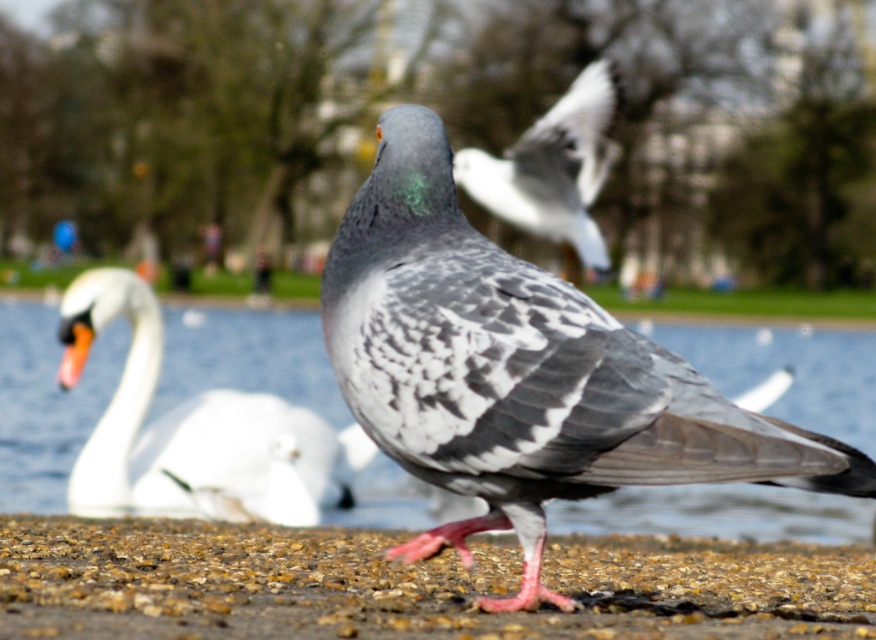
Does point (464, 408) lie behind point (146, 632)?

Yes, point (464, 408) is farther from viewer.

Which of these two, speckled feather pigeon at center or brown gravel at center, stands shorter?

brown gravel at center

Which is in front, point (358, 388) or point (404, 620)?

Positioned in front is point (358, 388).

Find the location of a particular element. The height and width of the screenshot is (640, 876). speckled feather pigeon at center is located at coordinates (520, 372).

The image size is (876, 640). What do you see at coordinates (520, 372) in the screenshot?
I see `speckled feather pigeon at center` at bounding box center [520, 372].

Does speckled feather pigeon at center have a greater width compared to white glossy swan at left?

Incorrect, speckled feather pigeon at center's width does not surpass white glossy swan at left's.

Is point (357, 358) positioned in front of point (366, 460)?

Yes, point (357, 358) is in front of point (366, 460).

You are a GUI agent. You are given a task and a screenshot of the screen. Output one action in this format:
    pyautogui.click(x=<x>, y=<y>)
    Task: Click on the speckled feather pigeon at center
    
    Given the screenshot: What is the action you would take?
    pyautogui.click(x=520, y=372)

Does brown gravel at center appear over white glossy swan at left?

Incorrect, brown gravel at center is not positioned above white glossy swan at left.

Can you confirm if brown gravel at center is thinner than white glossy swan at left?

Incorrect, brown gravel at center's width is not less than white glossy swan at left's.

This screenshot has width=876, height=640. I want to click on brown gravel at center, so click(x=408, y=584).

Where is `brown gravel at center`? Image resolution: width=876 pixels, height=640 pixels. brown gravel at center is located at coordinates (408, 584).